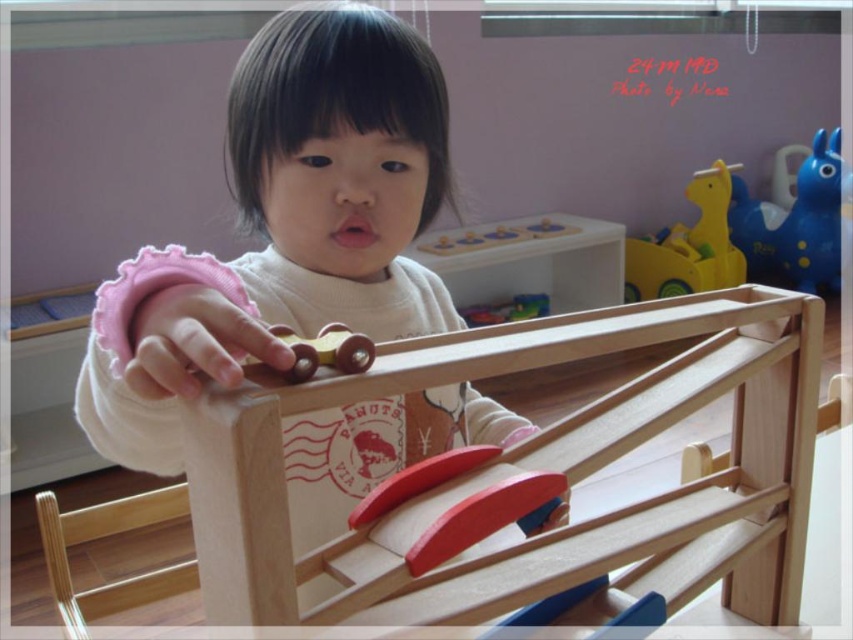
Is blue rubber horse at upper right shorter than wooden car at center?

In fact, blue rubber horse at upper right may be taller than wooden car at center.

Measure the distance between point (828, 241) and camera.

Point (828, 241) and camera are 11.16 feet apart from each other.

Does point (822, 132) come in front of point (283, 326)?

No, it is not.

Find the location of a particular element. blue rubber horse at upper right is located at coordinates (793, 221).

Which of these two, wooden car at center or wooden toy car at center, stands taller?

Result: Standing taller between the two is wooden toy car at center.

Measure the distance between wooden car at center and wooden toy car at center.

They are 8.49 feet apart.

Find the location of `wooden car at center`. wooden car at center is located at coordinates (325, 349).

Can you confirm if blue rubber horse at upper right is positioned to the left of wooden toy car at center?

Answer: In fact, blue rubber horse at upper right is to the right of wooden toy car at center.

Does point (839, 284) come closer to viewer compared to point (540, 312)?

No, (839, 284) is further to viewer.

At what (x,y) coordinates should I click in order to perform the action: click on blue rubber horse at upper right. Please return your answer as a coordinate pair (x, y). Looking at the image, I should click on (793, 221).